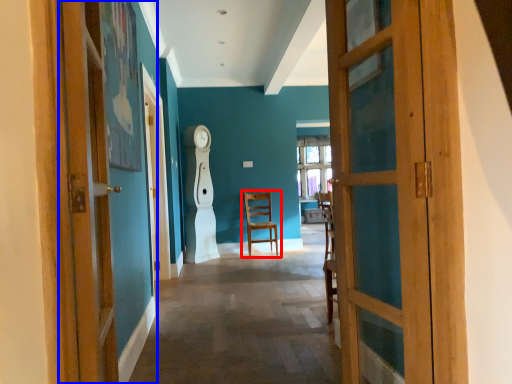
Question: Which object is closer to the camera taking this photo, chair (highlighted by a red box) or door (highlighted by a blue box)?

Choices:
 (A) chair
 (B) door

Answer: (B)